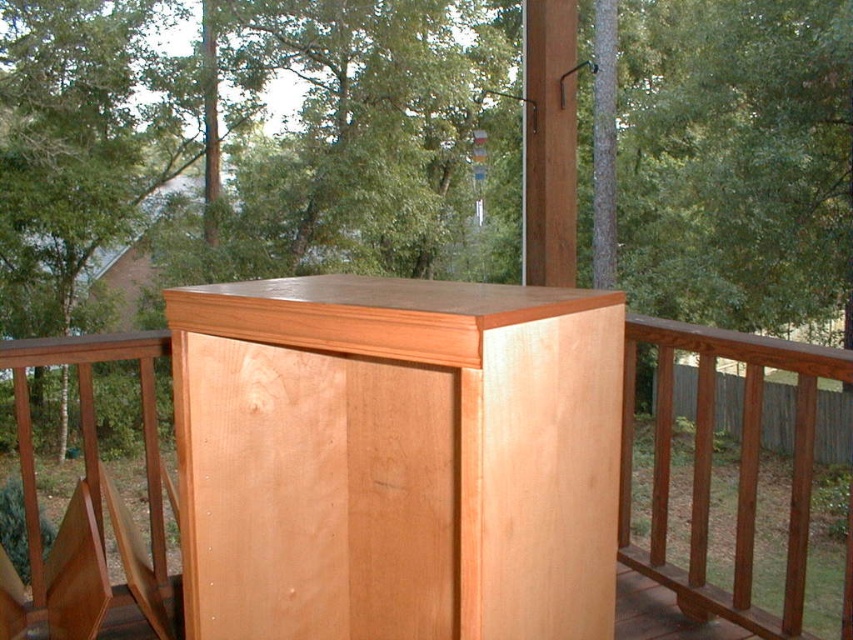
Question: Which of the following is the farthest from the observer?

Choices:
 (A) natural wood tree at center
 (B) light brown wood balustrade at center

Answer: (A)

Question: Which object is positioned farthest from the natural wood cabinet at center?

Choices:
 (A) light brown wood balustrade at center
 (B) natural wood tree at center

Answer: (B)

Question: Where is natural wood cabinet at center located in relation to light brown wood balustrade at center in the image?

Choices:
 (A) above
 (B) below

Answer: (A)

Question: Can you confirm if natural wood tree at center is wider than light brown wood balustrade at center?

Choices:
 (A) no
 (B) yes

Answer: (B)

Question: Is natural wood tree at center closer to the viewer compared to natural wood cabinet at center?

Choices:
 (A) yes
 (B) no

Answer: (B)

Question: Which point is closer to the camera?

Choices:
 (A) (846, 538)
 (B) (700, 456)
 (C) (115, 180)

Answer: (A)